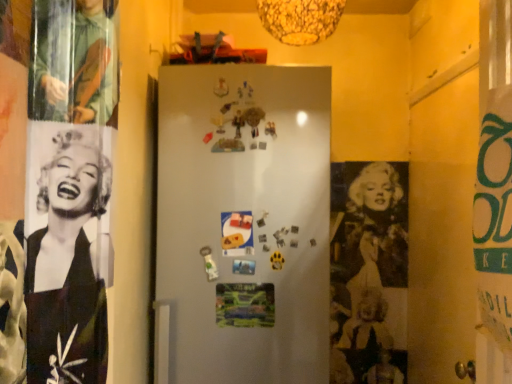
Question: From a real-world perspective, is matte paper poster at center, which is the 1th poster page from top to bottom, over metallic silver poster at center, which is the 2th poster page in top-to-bottom order?

Choices:
 (A) yes
 (B) no

Answer: (A)

Question: Would you say matte paper poster at center, arranged as the second poster page when ordered from the bottom, contains metallic silver poster at center, which is the 2th poster page in top-to-bottom order?

Choices:
 (A) yes
 (B) no

Answer: (B)

Question: Is the surface of matte paper poster at center, which is the 1th poster page from top to bottom, in direct contact with metallic silver poster at center, which is the 2th poster page in top-to-bottom order?

Choices:
 (A) no
 (B) yes

Answer: (A)

Question: Is matte paper poster at center, which is the 1th poster page from top to bottom, looking in the opposite direction of metallic silver poster at center, positioned as the first poster page in bottom-to-top order?

Choices:
 (A) no
 (B) yes

Answer: (A)

Question: Are matte paper poster at center, arranged as the second poster page when ordered from the bottom, and metallic silver poster at center, which is the 2th poster page in top-to-bottom order, located far from each other?

Choices:
 (A) yes
 (B) no

Answer: (B)

Question: Is matte paper poster at center, which is the 1th poster page from top to bottom, oriented towards metallic silver poster at center, positioned as the first poster page in bottom-to-top order?

Choices:
 (A) no
 (B) yes

Answer: (A)

Question: Is metallic silver poster at center, which is the 2th poster page in top-to-bottom order, behind matte paper poster at center, which is the 1th poster page from top to bottom?

Choices:
 (A) no
 (B) yes

Answer: (B)

Question: Is metallic silver poster at center, positioned as the first poster page in bottom-to-top order, completely or partially outside of matte paper poster at center, which is the 1th poster page from top to bottom?

Choices:
 (A) no
 (B) yes

Answer: (B)

Question: Is metallic silver poster at center, which is the 2th poster page in top-to-bottom order, not close to matte paper poster at center, arranged as the second poster page when ordered from the bottom?

Choices:
 (A) yes
 (B) no

Answer: (B)

Question: Is metallic silver poster at center, positioned as the first poster page in bottom-to-top order, oriented away from matte paper poster at center, which is the 1th poster page from top to bottom?

Choices:
 (A) no
 (B) yes

Answer: (A)

Question: From the image's perspective, is metallic silver poster at center, which is the 2th poster page in top-to-bottom order, on matte paper poster at center, which is the 1th poster page from top to bottom?

Choices:
 (A) no
 (B) yes

Answer: (A)

Question: From a real-world perspective, is metallic silver poster at center, which is the 2th poster page in top-to-bottom order, physically below matte paper poster at center, arranged as the second poster page when ordered from the bottom?

Choices:
 (A) yes
 (B) no

Answer: (A)

Question: From the image's perspective, is metallic silver poster at center, positioned as the first poster page in bottom-to-top order, above or below matte paper poster at center, arranged as the second poster page when ordered from the bottom?

Choices:
 (A) below
 (B) above

Answer: (A)